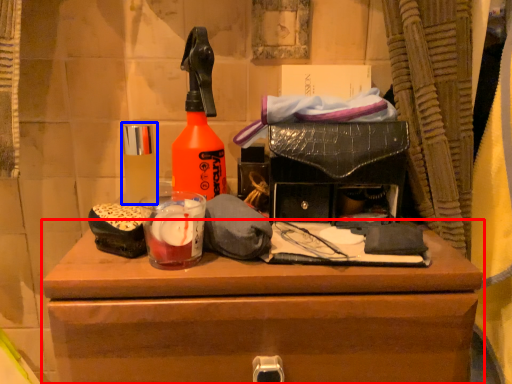
Question: Among these objects, which one is farthest to the camera, chest of drawers (highlighted by a red box) or toiletry (highlighted by a blue box)?

Choices:
 (A) chest of drawers
 (B) toiletry

Answer: (B)